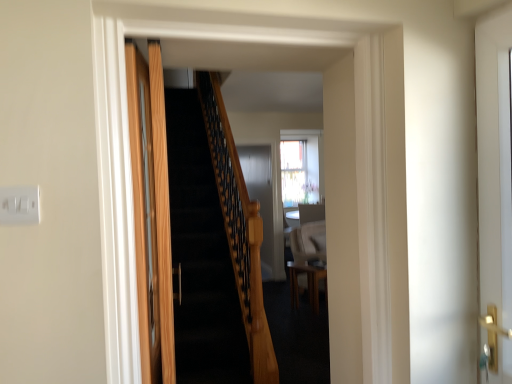
Question: Is white glossy door at right, arranged as the 2th door when viewed from the left, a part of wooden table at center?

Choices:
 (A) yes
 (B) no

Answer: (B)

Question: Considering the relative sizes of wooden table at center and white glossy door at right, arranged as the 2th door when viewed from the left, in the image provided, is wooden table at center taller than white glossy door at right, arranged as the 2th door when viewed from the left,?

Choices:
 (A) yes
 (B) no

Answer: (B)

Question: Can you confirm if wooden table at center is smaller than white glossy door at right, arranged as the 2th door when viewed from the left?

Choices:
 (A) yes
 (B) no

Answer: (B)

Question: Is wooden table at center at the left side of white glossy door at right, the first door viewed from the right?

Choices:
 (A) yes
 (B) no

Answer: (A)

Question: From a real-world perspective, does wooden table at center stand above white glossy door at right, arranged as the 2th door when viewed from the left?

Choices:
 (A) no
 (B) yes

Answer: (A)

Question: Is wooden table at center positioned in front of white glossy door at right, the first door viewed from the right?

Choices:
 (A) yes
 (B) no

Answer: (B)

Question: From the image's perspective, would you say white plastic/light switch at upper left is shown under wooden door at left, which is the 1th door from left to right?

Choices:
 (A) yes
 (B) no

Answer: (B)

Question: Is white plastic/light switch at upper left not close to wooden door at left, the 2th door positioned from the right?

Choices:
 (A) no
 (B) yes

Answer: (A)

Question: Is white plastic/light switch at upper left to the right of wooden door at left, which is the 1th door from left to right, from the viewer's perspective?

Choices:
 (A) yes
 (B) no

Answer: (B)

Question: Is white plastic/light switch at upper left positioned with its back to wooden door at left, the 2th door positioned from the right?

Choices:
 (A) no
 (B) yes

Answer: (A)

Question: Considering the relative sizes of white plastic/light switch at upper left and wooden door at left, the 2th door positioned from the right, in the image provided, is white plastic/light switch at upper left smaller than wooden door at left, the 2th door positioned from the right,?

Choices:
 (A) yes
 (B) no

Answer: (A)

Question: Does white plastic/light switch at upper left come in front of wooden door at left, the 2th door positioned from the right?

Choices:
 (A) no
 (B) yes

Answer: (B)

Question: Is the depth of wooden door at left, the 2th door positioned from the right, less than that of white glossy door at right, the first door viewed from the right?

Choices:
 (A) no
 (B) yes

Answer: (B)